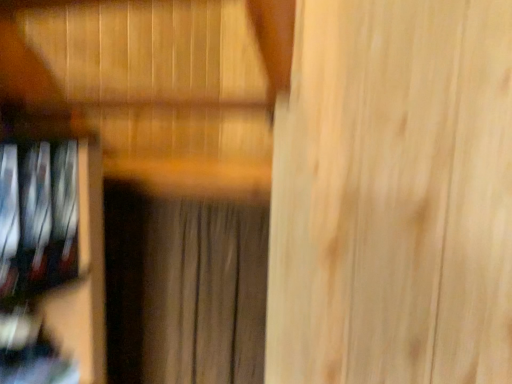
This screenshot has width=512, height=384. I want to click on brown textured curtain at center, so click(204, 293).

What do you see at coordinates (204, 293) in the screenshot? I see `brown textured curtain at center` at bounding box center [204, 293].

Describe the element at coordinates (52, 262) in the screenshot. I see `metallic silver dvds at left` at that location.

Identify the location of metallic silver dvds at left. The height and width of the screenshot is (384, 512). (52, 262).

What are the coordinates of `brown textured curtain at center` in the screenshot? It's located at (204, 293).

Between brown textured curtain at center and metallic silver dvds at left, which one appears on the right side from the viewer's perspective?

brown textured curtain at center is more to the right.

Is brown textured curtain at center positioned before metallic silver dvds at left?

That is False.

Does point (225, 266) come in front of point (66, 329)?

No, it is behind (66, 329).

From the image's perspective, is brown textured curtain at center on metallic silver dvds at left?

Incorrect, from the image's perspective, brown textured curtain at center is lower than metallic silver dvds at left.

From a real-world perspective, is brown textured curtain at center on top of metallic silver dvds at left?

Actually, brown textured curtain at center is physically below metallic silver dvds at left in the real world.

Looking at their sizes, would you say brown textured curtain at center is wider or thinner than metallic silver dvds at left?

In the image, brown textured curtain at center appears to be more narrow than metallic silver dvds at left.

In terms of height, does brown textured curtain at center look taller or shorter compared to metallic silver dvds at left?

Clearly, brown textured curtain at center is taller compared to metallic silver dvds at left.

Is brown textured curtain at center smaller than metallic silver dvds at left?

Incorrect, brown textured curtain at center is not smaller in size than metallic silver dvds at left.

Is brown textured curtain at center located outside metallic silver dvds at left?

brown textured curtain at center is positioned outside metallic silver dvds at left.

Is brown textured curtain at center next to metallic silver dvds at left?

No, brown textured curtain at center is not with metallic silver dvds at left.

Is brown textured curtain at center facing away from metallic silver dvds at left?

That's not correct — brown textured curtain at center is not looking away from metallic silver dvds at left.

Can you tell me how much brown textured curtain at center and metallic silver dvds at left differ in facing direction?

A: 89.2 degrees separate the facing orientations of brown textured curtain at center and metallic silver dvds at left.

Where is `shelf above the brown textured curtain at center (from the image's perspective)`? The width and height of the screenshot is (512, 384). shelf above the brown textured curtain at center (from the image's perspective) is located at coordinates click(x=52, y=262).

Visually, is metallic silver dvds at left positioned to the left or to the right of brown textured curtain at center?

metallic silver dvds at left is to the left of brown textured curtain at center.

Which object is further away from the camera, metallic silver dvds at left or brown textured curtain at center?

brown textured curtain at center is further away from the camera.

Which is less distant, (11, 241) or (146, 313)?

The point (11, 241) is closer to the camera.

From the image's perspective, does metallic silver dvds at left appear lower than brown textured curtain at center?

Incorrect, from the image's perspective, metallic silver dvds at left is higher than brown textured curtain at center.

From a real-world perspective, which object stands above the other?

In real-world perspective, metallic silver dvds at left is above.

Between metallic silver dvds at left and brown textured curtain at center, which one has larger width?

Wider between the two is metallic silver dvds at left.

In terms of height, does metallic silver dvds at left look taller or shorter compared to brown textured curtain at center?

Considering their sizes, metallic silver dvds at left has less height than brown textured curtain at center.

Based on the photo, considering the sizes of objects metallic silver dvds at left and brown textured curtain at center in the image provided, who is bigger, metallic silver dvds at left or brown textured curtain at center?

brown textured curtain at center is bigger.

Can brown textured curtain at center be found inside metallic silver dvds at left?

That's incorrect, brown textured curtain at center is not inside metallic silver dvds at left.

Is metallic silver dvds at left far from brown textured curtain at center?

No, there isn't a large distance between metallic silver dvds at left and brown textured curtain at center.

Consider the image. Does metallic silver dvds at left turn towards brown textured curtain at center?

No, metallic silver dvds at left is not facing towards brown textured curtain at center.

What's the angular difference between metallic silver dvds at left and brown textured curtain at center's facing directions?

89.2 degrees.

Locate an element on the screen. Image resolution: width=512 pixels, height=384 pixels. shelf above the brown textured curtain at center (from the image's perspective) is located at coordinates (52, 262).

Identify the location of curtain below the metallic silver dvds at left (from a real-world perspective). (204, 293).

Find the location of a particular element. shelf lying above the brown textured curtain at center (from the image's perspective) is located at coordinates (52, 262).